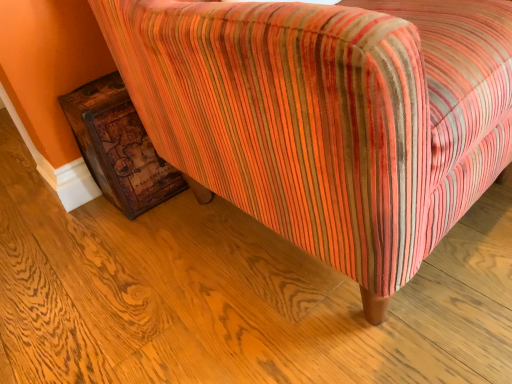
You are a GUI agent. You are given a task and a screenshot of the screen. Output one action in this format:
    pyautogui.click(x=<x>, y=<y>)
    Task: Click on the free location in front of distressed wood trunk at lower left
    The height and width of the screenshot is (384, 512).
    Given the screenshot: What is the action you would take?
    pyautogui.click(x=123, y=235)